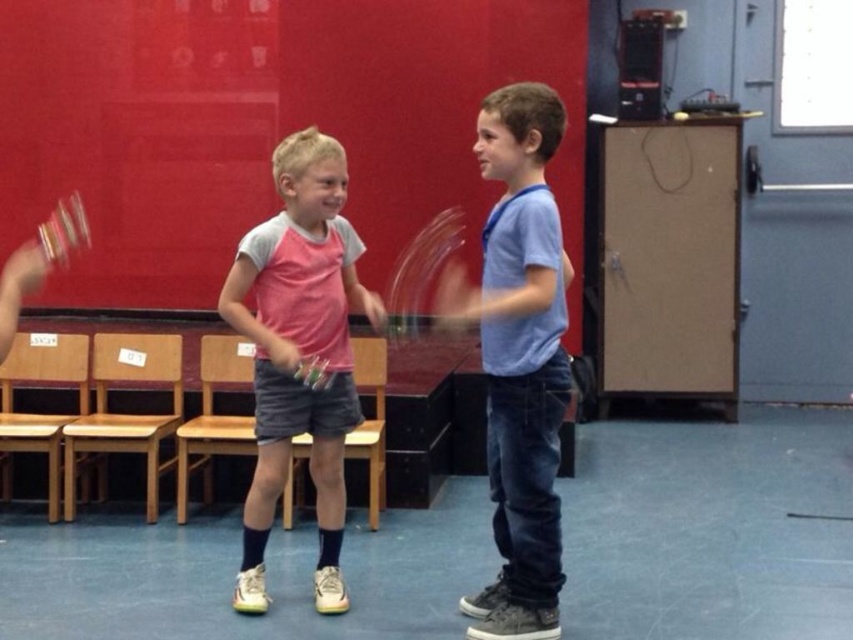
Question: Does clear plastic tennis racket at center come in front of clear plastic tennis racket at left?

Choices:
 (A) yes
 (B) no

Answer: (A)

Question: Estimate the real-world distances between objects in this image. Which object is closer to the clear plastic tennis racket at left?

Choices:
 (A) pink fabric shirt at center
 (B) clear plastic tennis racket at center

Answer: (B)

Question: Which of the following is the closest to the observer?

Choices:
 (A) (350, 422)
 (B) (64, 216)
 (C) (490, 385)

Answer: (C)

Question: Which object is the closest to the clear plastic tennis racket at center?

Choices:
 (A) blue denim jeans at center
 (B) clear plastic tennis racket at left
 (C) pink fabric shirt at center

Answer: (B)

Question: Can you confirm if pink fabric shirt at center is bigger than clear plastic tennis racket at left?

Choices:
 (A) yes
 (B) no

Answer: (A)

Question: Is blue denim jeans at center bigger than clear plastic tennis racket at center?

Choices:
 (A) yes
 (B) no

Answer: (A)